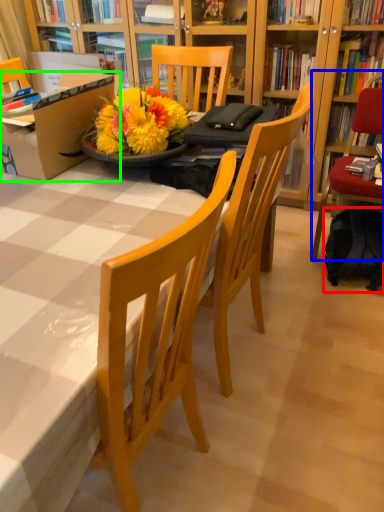
Question: Considering the real-world distances, which object is closest to backpack (highlighted by a red box)? chair (highlighted by a blue box) or box (highlighted by a green box).

Choices:
 (A) chair
 (B) box

Answer: (A)